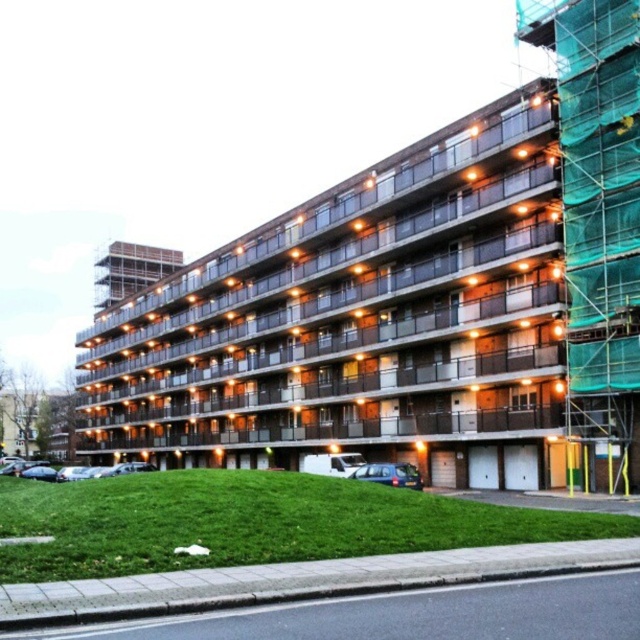
You are standing in front of a building and want to take a photo of the brown concrete building at center and the green mesh scaffolding at right. Which object should you focus on first if you want both to be in clear focus?

You should focus on the brown concrete building at center first because it is closer to you than the green mesh scaffolding at right, so adjusting focus from near to far will help both be in clear focus.

You are standing in front of a building and want to take a photo of the brown concrete building at center. According to the coordinates provided, where should you position your camera to capture the building in the frame?

The brown concrete building at center is located at coordinates point (362, 323), so you should position your camera to aim at that point to capture the building in the frame.